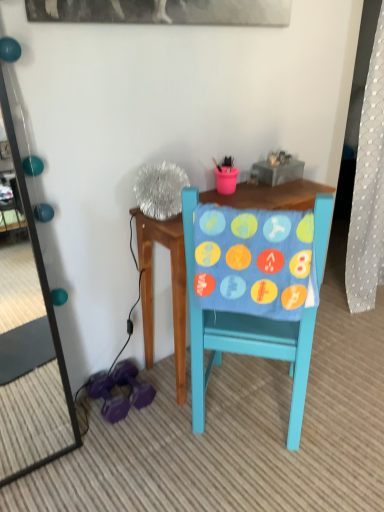
Question: Looking at their shapes, would you say teal glossy mirror at left is wider or thinner than matte blue chair at center?

Choices:
 (A) wide
 (B) thin

Answer: (B)

Question: Considering the positions of teal glossy mirror at left and matte blue chair at center in the image, is teal glossy mirror at left bigger or smaller than matte blue chair at center?

Choices:
 (A) small
 (B) big

Answer: (A)

Question: Which is farther from the teal glossy mirror at left?

Choices:
 (A) matte blue chair at center
 (B) blue fabric with colorful patches at center

Answer: (B)

Question: Which object is positioned farthest from the matte blue chair at center?

Choices:
 (A) blue fabric with colorful patches at center
 (B) teal glossy mirror at left

Answer: (B)